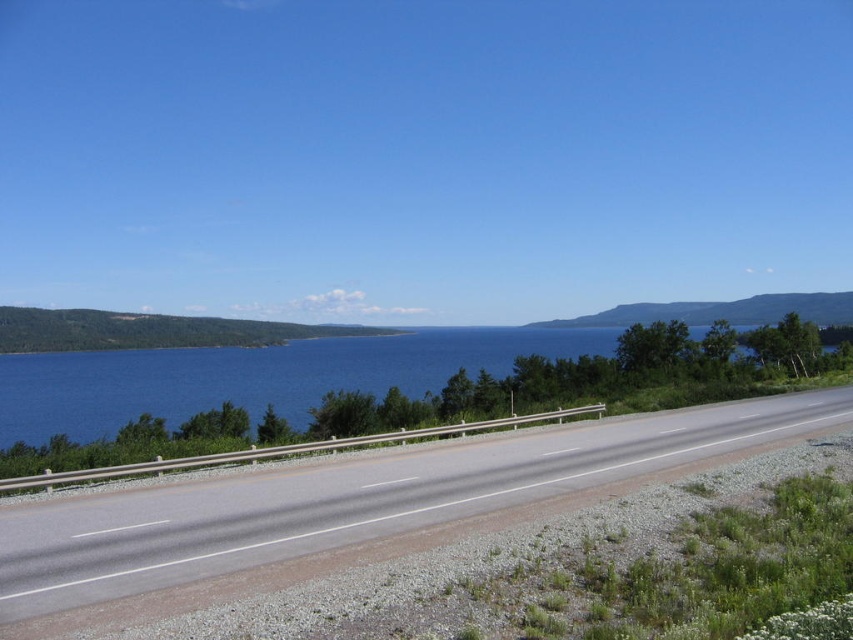
You are driving a car that requires a 8 meter stopping distance. You are currently on the asphalt road at center and need to stop. Is there enough space between your current position and the camera to safely stop your car?

The distance between the asphalt road at center and the camera is 7.92 meters, which is slightly less than the required 8 meters stopping distance. Therefore, there is not enough space to safely stop the car.

You are driving a car and want to reach the blue water at center from the asphalt road at center. Which direction should you turn to get there?

Since the asphalt road at center is to the right of blue water at center, you should turn left to reach the blue water at center from the asphalt road at center.